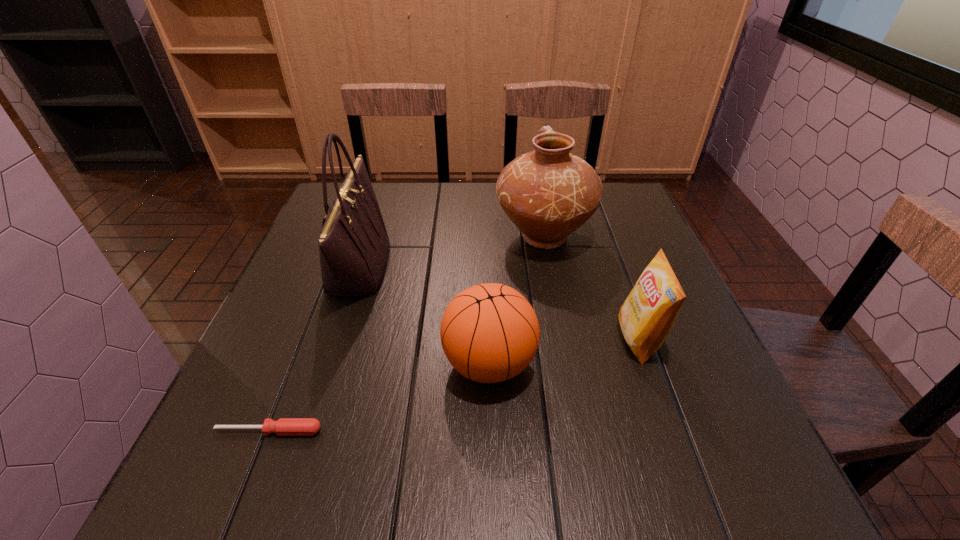
I want to click on crisp (potato chip) present at the right edge, so click(x=647, y=315).

What are the coordinates of `object that is at the far left corner` in the screenshot? It's located at (353, 244).

Locate an element on the screen. The width and height of the screenshot is (960, 540). object present at the far right corner is located at coordinates (548, 193).

The height and width of the screenshot is (540, 960). Identify the location of vacant area at the far edge of the desktop. (512, 224).

Identify the location of blank space at the near edge of the desktop. (390, 488).

The image size is (960, 540). I want to click on vacant region at the left edge of the desktop, so click(x=272, y=440).

The height and width of the screenshot is (540, 960). Identify the location of free space at the right edge. (654, 375).

In the image, there is a desktop. Where is `free space at the far left corner`? free space at the far left corner is located at coordinates (382, 185).

This screenshot has height=540, width=960. In order to click on free space at the near left corner of the desktop in this screenshot , I will do `click(203, 461)`.

The height and width of the screenshot is (540, 960). Identify the location of free region at the far right corner of the desktop. (610, 209).